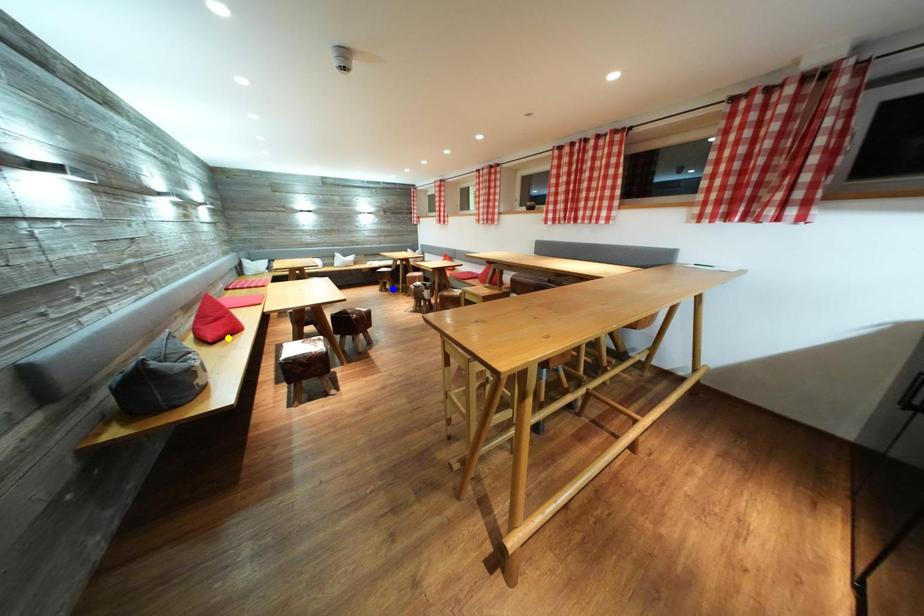
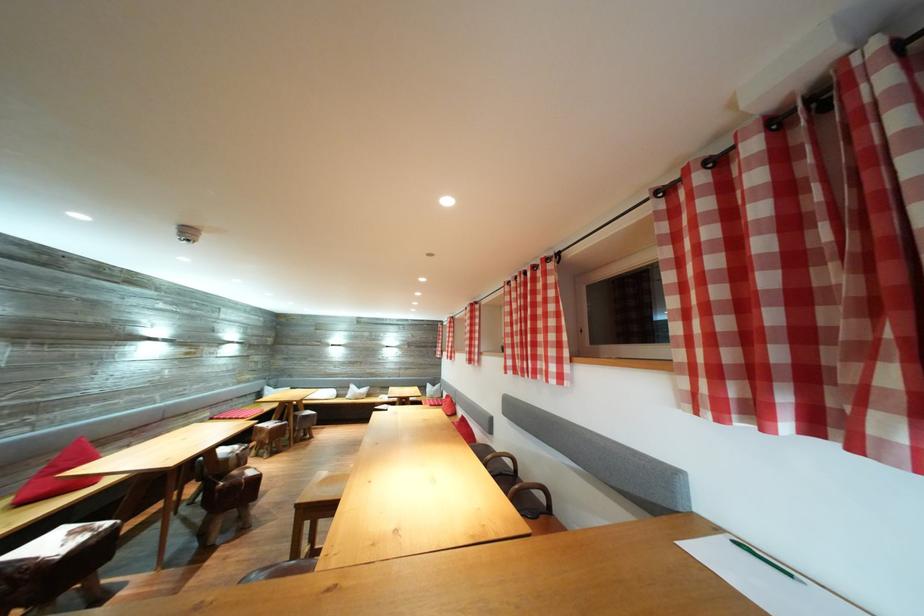
I am providing you with two images of the same scene from different viewpoints. Three points are marked in image1. Which point corresponds to a part or object that is occluded in image2?In image1, three points are marked. Which of them correspond to a part or object that is occluded in image2?Among the three points shown in image1, which one corresponds to a part or object that is no longer visible due to occlusion in image2?

green point, blue point